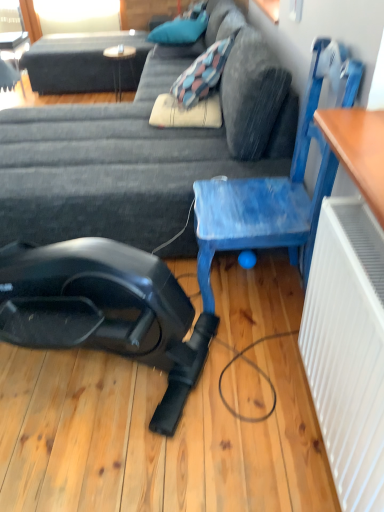
Question: Considering the positions of blue painted wood chair at center right and blue fabric pillow at upper center in the image, is blue painted wood chair at center right wider or thinner than blue fabric pillow at upper center?

Choices:
 (A) thin
 (B) wide

Answer: (A)

Question: From the image's perspective, is blue painted wood chair at center right positioned above or below blue fabric pillow at upper center?

Choices:
 (A) below
 (B) above

Answer: (A)

Question: Based on their relative distances, which object is farther from the wooden table at upper center?

Choices:
 (A) dark gray fabric couch at center
 (B) blue painted wood chair at center right
 (C) blue fabric pillow at upper center

Answer: (B)

Question: Considering the real-world distances, which object is closest to the blue fabric pillow at upper center?

Choices:
 (A) wooden table at upper center
 (B) blue painted wood chair at center right
 (C) dark gray fabric couch at center

Answer: (A)